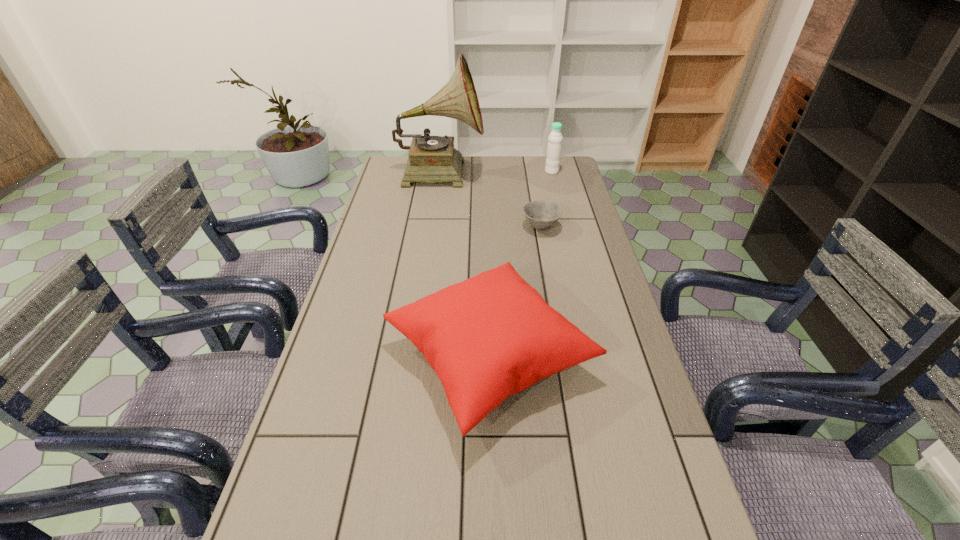
In the image, there is a desktop. In order to click on vacant space at the right edge in this screenshot , I will do `click(637, 401)`.

This screenshot has width=960, height=540. In the image, there is a desktop. What are the coordinates of `free region at the far right corner` in the screenshot? It's located at (556, 176).

The width and height of the screenshot is (960, 540). What are the coordinates of `free space that is in between the water bottle and the cushion` in the screenshot? It's located at (520, 264).

The height and width of the screenshot is (540, 960). I want to click on free space between the second tallest object and the third tallest object, so click(x=520, y=264).

Locate an element on the screen. This screenshot has width=960, height=540. unoccupied position between the third shortest object and the record player is located at coordinates (496, 172).

Find the location of a particular element. The image size is (960, 540). free space that is in between the water bottle and the record player is located at coordinates (496, 172).

This screenshot has height=540, width=960. I want to click on object that ranks as the second closest to the tallest object, so click(x=554, y=147).

Select which object is the second closest to the third tallest object. Please provide its 2D coordinates. Your answer should be formatted as a tuple, i.e. [(x, y)], where the tuple contains the x and y coordinates of a point satisfying the conditions above.

[(431, 159)]

Where is `vacant space that satisfies the following two spatial constraints: 1. from the horn of the record player; 2. on the left side of the water bottle`? The height and width of the screenshot is (540, 960). vacant space that satisfies the following two spatial constraints: 1. from the horn of the record player; 2. on the left side of the water bottle is located at coordinates (441, 172).

Find the location of a particular element. The width and height of the screenshot is (960, 540). vacant space that satisfies the following two spatial constraints: 1. from the horn of the nearest object; 2. on the left side of the tallest object is located at coordinates (414, 356).